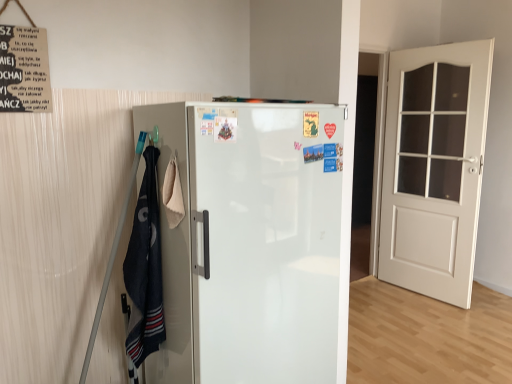
What do you see at coordinates (24, 70) in the screenshot? I see `black paper poster at upper left` at bounding box center [24, 70].

Image resolution: width=512 pixels, height=384 pixels. Identify the location of white wood door at right. (434, 168).

Identify the location of black paper poster at upper left. Image resolution: width=512 pixels, height=384 pixels. (24, 70).

Which object is thinner, dark blue cotton towel at left or black paper poster at upper left?

black paper poster at upper left.

Considering the sizes of dark blue cotton towel at left and black paper poster at upper left in the image, is dark blue cotton towel at left bigger or smaller than black paper poster at upper left?

In the image, dark blue cotton towel at left appears to be larger than black paper poster at upper left.

Is dark blue cotton towel at left aimed at black paper poster at upper left?

No, dark blue cotton towel at left is not aimed at black paper poster at upper left.

Which is behind, point (383, 279) or point (19, 50)?

The point (383, 279) is behind.

Does white wood door at right come in front of black paper poster at upper left?

No, the depth of white wood door at right is greater than that of black paper poster at upper left.

Consider the image. From the image's perspective, is white wood door at right on top of black paper poster at upper left?

Incorrect, from the image's perspective, white wood door at right is lower than black paper poster at upper left.

What's the angular difference between white wood door at right and black paper poster at upper left's facing directions?

They differ by 83.5 degrees in their facing directions.

Which object is further away from the camera, dark blue cotton towel at left or white wood door at right?

white wood door at right is behind.

Is dark blue cotton towel at left thinner than white wood door at right?

In fact, dark blue cotton towel at left might be wider than white wood door at right.

Identify the location of door on the right side of dark blue cotton towel at left. This screenshot has width=512, height=384. (434, 168).

Is dark blue cotton towel at left to the right of white wood door at right from the viewer's perspective?

No.

Find the location of `door that is above the white glossy refrigerator at center (from the image's perspective)`. door that is above the white glossy refrigerator at center (from the image's perspective) is located at coordinates (434, 168).

Looking at their sizes, would you say white glossy refrigerator at center is wider or thinner than white wood door at right?

white glossy refrigerator at center is wider than white wood door at right.

Is white glossy refrigerator at center inside or outside of white wood door at right?

white glossy refrigerator at center is not inside white wood door at right, it's outside.

Which of these two, white glossy refrigerator at center or white wood door at right, is smaller?

white wood door at right is smaller.

Who is taller, white wood door at right or dark blue cotton towel at left?

With more height is white wood door at right.

Is dark blue cotton towel at left at the back of white wood door at right?

white wood door at right does not have its back to dark blue cotton towel at left.

Is point (484, 65) more distant than point (138, 260)?

Yes, point (484, 65) is behind point (138, 260).

Is white wood door at right positioned beyond the bounds of dark blue cotton towel at left?

Absolutely, white wood door at right is external to dark blue cotton towel at left.

Locate an element on the screen. This screenshot has height=384, width=512. poster on the left side of white glossy refrigerator at center is located at coordinates (24, 70).

From the picture: Is black paper poster at upper left next to white glossy refrigerator at center?

No, black paper poster at upper left is not touching white glossy refrigerator at center.

Who is more distant, black paper poster at upper left or white glossy refrigerator at center?

black paper poster at upper left is further from the camera.

Can you confirm if black paper poster at upper left is smaller than white glossy refrigerator at center?

Yes, black paper poster at upper left is smaller than white glossy refrigerator at center.

From the image's perspective, who appears lower, white glossy refrigerator at center or black paper poster at upper left?

white glossy refrigerator at center.

In the scene shown: Which is nearer, (245, 189) or (33, 28)?

Clearly, point (245, 189) is closer to the camera than point (33, 28).

Consider the image. Considering the sizes of objects white glossy refrigerator at center and black paper poster at upper left in the image provided, who is wider, white glossy refrigerator at center or black paper poster at upper left?

white glossy refrigerator at center.

Does white glossy refrigerator at center turn towards black paper poster at upper left?

No, white glossy refrigerator at center does not turn towards black paper poster at upper left.

At what (x,y) coordinates should I click in order to perform the action: click on poster located above the dark blue cotton towel at left (from a real-world perspective). Please return your answer as a coordinate pair (x, y). This screenshot has width=512, height=384. Looking at the image, I should click on (24, 70).

You are a GUI agent. You are given a task and a screenshot of the screen. Output one action in this format:
    pyautogui.click(x=<x>, y=<y>)
    Task: Click on the door that is below the black paper poster at upper left (from the image's perspective)
    The width and height of the screenshot is (512, 384).
    Given the screenshot: What is the action you would take?
    pyautogui.click(x=434, y=168)

Considering their positions, is black paper poster at upper left positioned further to dark blue cotton towel at left than white glossy refrigerator at center?

The object further to dark blue cotton towel at left is black paper poster at upper left.

Estimate the real-world distances between objects in this image. Which object is closer to black paper poster at upper left, white wood door at right or white glossy refrigerator at center?

Based on the image, white glossy refrigerator at center appears to be nearer to black paper poster at upper left.

Based on their spatial positions, is black paper poster at upper left or dark blue cotton towel at left further from white glossy refrigerator at center?

black paper poster at upper left is further to white glossy refrigerator at center.

Considering their positions, is white glossy refrigerator at center positioned closer to black paper poster at upper left than white wood door at right?

The object closer to black paper poster at upper left is white glossy refrigerator at center.

Estimate the real-world distances between objects in this image. Which object is further from black paper poster at upper left, white wood door at right or dark blue cotton towel at left?

The object further to black paper poster at upper left is white wood door at right.

Based on their spatial positions, is dark blue cotton towel at left or black paper poster at upper left further from white glossy refrigerator at center?

Among the two, black paper poster at upper left is located further to white glossy refrigerator at center.

Considering their positions, is black paper poster at upper left positioned closer to white wood door at right than dark blue cotton towel at left?

dark blue cotton towel at left lies closer to white wood door at right than the other object.

Estimate the real-world distances between objects in this image. Which object is closer to white glossy refrigerator at center, white wood door at right or black paper poster at upper left?

black paper poster at upper left is closer to white glossy refrigerator at center.

You are a GUI agent. You are given a task and a screenshot of the screen. Output one action in this format:
    pyautogui.click(x=<x>, y=<y>)
    Task: Click on the laundry located between white glossy refrigerator at center and white wood door at right in the depth direction
    The image size is (512, 384).
    Given the screenshot: What is the action you would take?
    pyautogui.click(x=145, y=269)

You are a GUI agent. You are given a task and a screenshot of the screen. Output one action in this format:
    pyautogui.click(x=<x>, y=<y>)
    Task: Click on the refrigerator between black paper poster at upper left and white wood door at right from left to right
    
    Given the screenshot: What is the action you would take?
    pyautogui.click(x=250, y=242)

This screenshot has width=512, height=384. Identify the location of laundry between black paper poster at upper left and white wood door at right. (145, 269).

The height and width of the screenshot is (384, 512). I want to click on laundry that lies between black paper poster at upper left and white glossy refrigerator at center from top to bottom, so click(x=145, y=269).